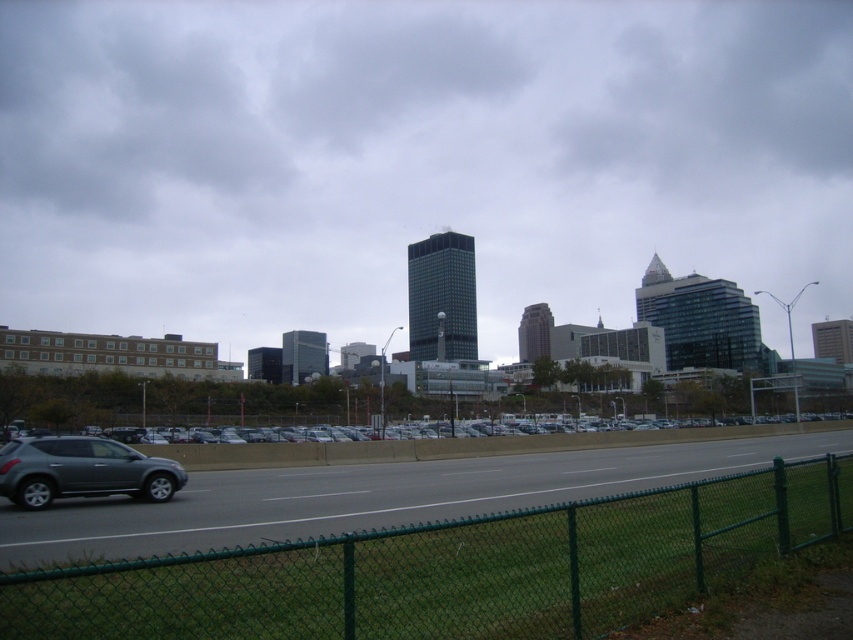
Is satin gray suv at lower left thinner than silver metallic sedan at center?

Correct, satin gray suv at lower left's width is less than silver metallic sedan at center's.

At what (x,y) coordinates should I click in order to perform the action: click on satin gray suv at lower left. Please return your answer as a coordinate pair (x, y). Image resolution: width=853 pixels, height=640 pixels. Looking at the image, I should click on (82, 470).

Measure the distance between point (x=596, y=161) and camera.

Point (x=596, y=161) is 284.12 meters away from camera.

Locate an element on the screen. transparent glass skyscraper at center is located at coordinates (415, 161).

The width and height of the screenshot is (853, 640). What do you see at coordinates (415, 161) in the screenshot? I see `transparent glass skyscraper at center` at bounding box center [415, 161].

Locate an element on the screen. transparent glass skyscraper at center is located at coordinates (415, 161).

Does green chain-link fence at lower center have a larger size compared to silver metallic sedan at center?

No, green chain-link fence at lower center is not bigger than silver metallic sedan at center.

Is green chain-link fence at lower center above silver metallic sedan at center?

Yes.

In the scene shown: Who is more forward, (381, 600) or (671, 438)?

Point (381, 600) is in front.

This screenshot has width=853, height=640. I want to click on green chain-link fence at lower center, so click(451, 568).